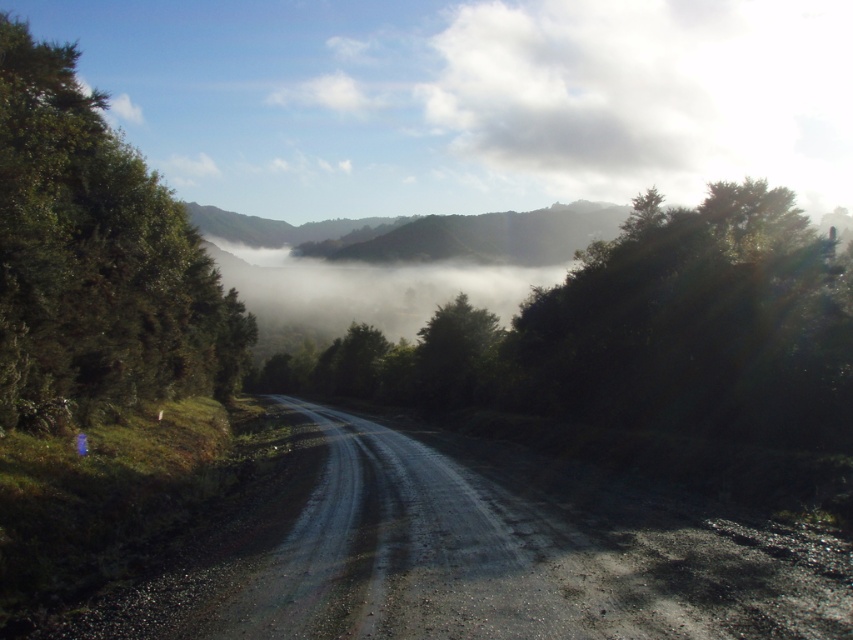
Question: Is dull gray gravel road at center closer to camera compared to green leafy tree at right?

Choices:
 (A) yes
 (B) no

Answer: (A)

Question: Which of the following is the farthest from the observer?

Choices:
 (A) (701, 32)
 (B) (718, 540)

Answer: (A)

Question: Which point is farther from the camera taking this photo?

Choices:
 (A) (88, 262)
 (B) (476, 324)
 (C) (422, 109)
 (D) (691, 360)

Answer: (C)

Question: Can you confirm if white fluffy cloud at upper center is positioned above green leafy tree at right?

Choices:
 (A) no
 (B) yes

Answer: (B)

Question: Where is dull gray gravel road at center located in relation to green matte tree at center in the image?

Choices:
 (A) above
 (B) below

Answer: (B)

Question: Which point is closer to the camera?

Choices:
 (A) (527, 556)
 (B) (21, 314)
 (C) (815, 170)
 (D) (825, 330)

Answer: (A)